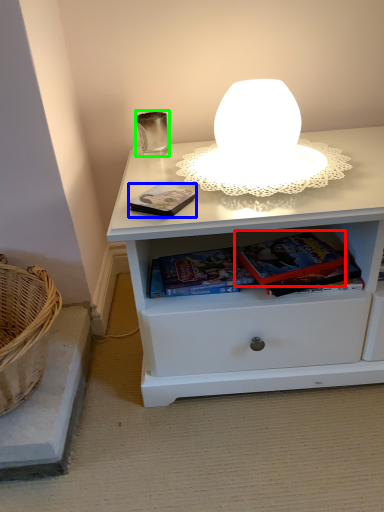
Question: Considering the real-world distances, which object is farthest from paperback book (highlighted by a red box)? paperback book (highlighted by a blue box) or candle holder (highlighted by a green box)?

Choices:
 (A) paperback book
 (B) candle holder

Answer: (B)